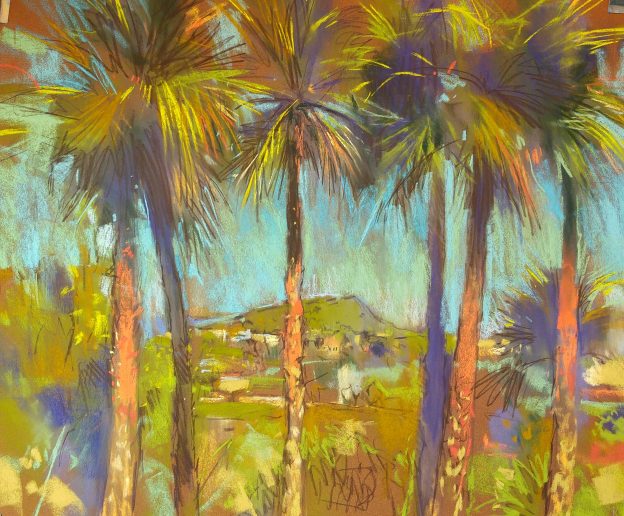
Locate an element on the screen. windows is located at coordinates coord(324,349).